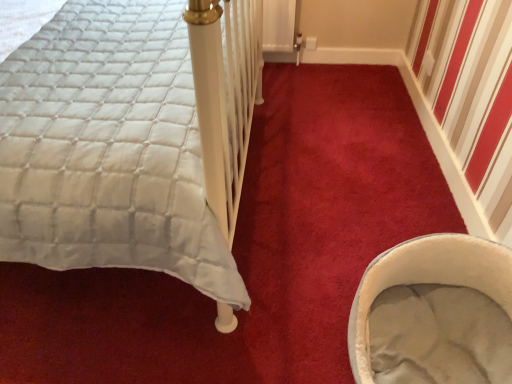
Find the location of `free space behind soft gray fabric baby carriage at lower right`. free space behind soft gray fabric baby carriage at lower right is located at coordinates (356, 221).